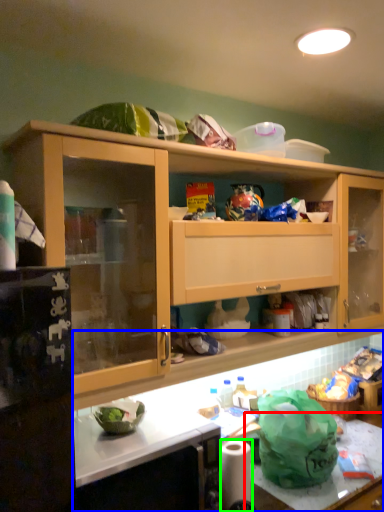
Question: Which object is positioned farthest from counter top (highlighted by a red box)? Select from countertop (highlighted by a blue box) and toilet paper (highlighted by a green box).

Choices:
 (A) countertop
 (B) toilet paper

Answer: (A)